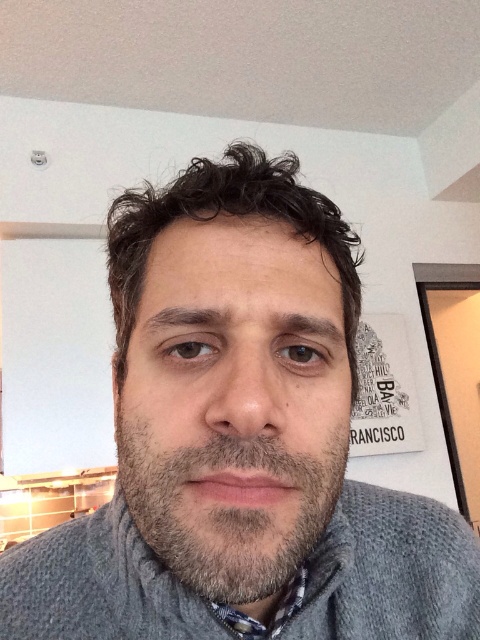
Is dark brown curly hair at center below patterned fabric shirt at lower center?

No, dark brown curly hair at center is not below patterned fabric shirt at lower center.

Locate an element on the screen. dark brown curly hair at center is located at coordinates (226, 216).

Is gray matte beard at center further to the viewer compared to patterned fabric shirt at lower center?

No, it is in front of patterned fabric shirt at lower center.

Does gray matte beard at center have a greater width compared to patterned fabric shirt at lower center?

Yes, gray matte beard at center is wider than patterned fabric shirt at lower center.

Between point (339, 468) and point (272, 634), which one is positioned in front?

Point (339, 468) is in front.

Identify the location of gray matte beard at center. (228, 506).

Is gray knitted sweater at center behind gray matte beard at center?

Yes, gray knitted sweater at center is behind gray matte beard at center.

The height and width of the screenshot is (640, 480). I want to click on gray knitted sweater at center, so click(389, 572).